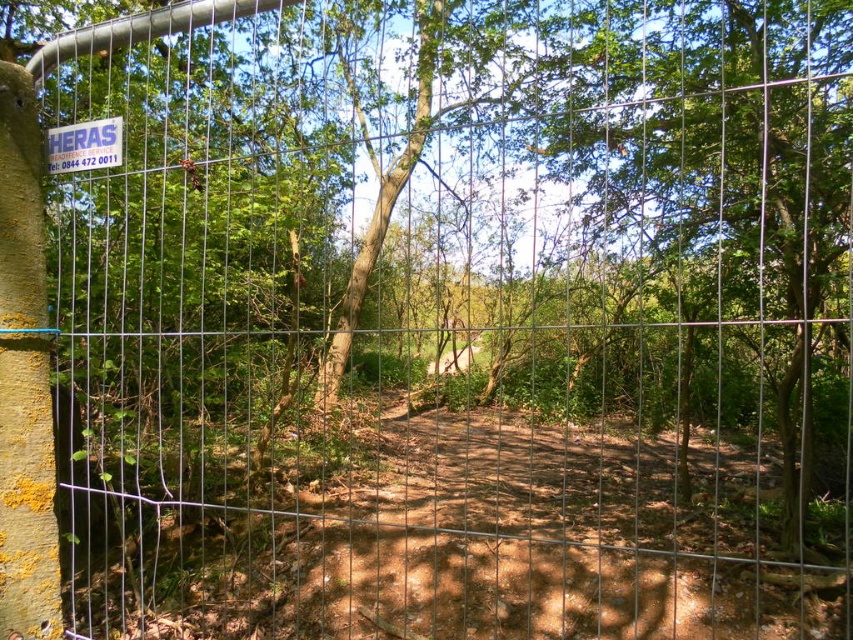
Question: Which point is closer to the camera?

Choices:
 (A) (260, 509)
 (B) (103, 156)

Answer: (B)

Question: Observing the image, what is the correct spatial positioning of brown dirt track at center in reference to white plastic sign at upper left?

Choices:
 (A) above
 (B) below

Answer: (B)

Question: Is brown dirt track at center positioned behind white plastic sign at upper left?

Choices:
 (A) no
 (B) yes

Answer: (A)

Question: Which point appears closest to the camera in this image?

Choices:
 (A) (628, 616)
 (B) (102, 164)

Answer: (B)

Question: Can you confirm if brown dirt track at center is thinner than white plastic sign at upper left?

Choices:
 (A) no
 (B) yes

Answer: (A)